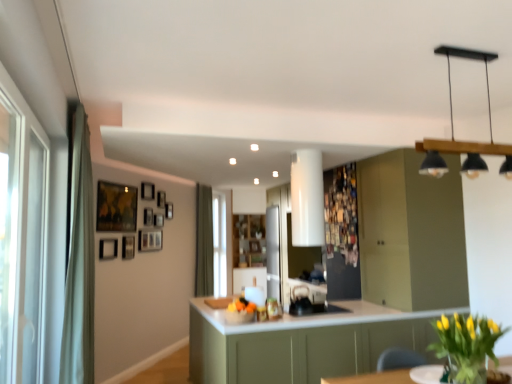
What do you see at coordinates (411, 233) in the screenshot?
I see `green matte cabinet at center, which is the 1th cabinetry from right to left` at bounding box center [411, 233].

This screenshot has height=384, width=512. Describe the element at coordinates (453, 131) in the screenshot. I see `black matte light fixture at upper right` at that location.

In order to click on wooden picture frame at upper left, the 4th picture frame viewed from the back in this screenshot , I will do point(148,216).

Locate an element on the screen. The image size is (512, 384). yellow-green leafy plant at lower right is located at coordinates (466, 345).

Image resolution: width=512 pixels, height=384 pixels. What are the coordinates of `wooden picture frame at center, positioned as the seventh picture frame in front-to-back order` in the screenshot? It's located at (158, 220).

Find the location of `wooden picture frame at upper center, the 2th picture frame when ordered from back to front`. wooden picture frame at upper center, the 2th picture frame when ordered from back to front is located at coordinates (161, 199).

Describe the element at coordinates (161, 199) in the screenshot. I see `wooden picture frame at upper center, the eighth picture frame viewed from the front` at that location.

I want to click on wooden framed map at upper left, the ninth picture frame in the back-to-front sequence, so click(x=116, y=207).

From a real-world perspective, count 1st picture frames upward from the white glossy round table at lower right and point to it. Please provide its 2D coordinates.

[(108, 249)]

Which is nearer, (111, 258) or (424, 376)?

The point (424, 376) is in front.

From the picture: Would you say matte black picture frame at upper left, placed as the 8th picture frame when sorted from back to front, is to the left or to the right of white glossy round table at lower right in the picture?

In the image, matte black picture frame at upper left, placed as the 8th picture frame when sorted from back to front, appears on the left side of white glossy round table at lower right.

Which object is closer to the camera, matte black picture frame at upper left, arranged as the second picture frame when viewed from the front, or white glossy round table at lower right?

white glossy round table at lower right.

Which is closer, (x=430, y=145) or (x=162, y=219)?

The point (x=430, y=145) is more forward.

Between black matte light fixture at upper right and wooden picture frame at center, marked as the third picture frame in a back-to-front arrangement, which one has smaller size?

With smaller size is wooden picture frame at center, marked as the third picture frame in a back-to-front arrangement.

From a real-world perspective, who is located higher, black matte light fixture at upper right or wooden picture frame at center, positioned as the seventh picture frame in front-to-back order?

From a 3D spatial view, black matte light fixture at upper right is above.

From the image's perspective, does black matte light fixture at upper right appear lower than wooden picture frame at center, positioned as the seventh picture frame in front-to-back order?

No, from the image's perspective, black matte light fixture at upper right is not below wooden picture frame at center, positioned as the seventh picture frame in front-to-back order.

Is black matte light fixture at upper right to the left of green matte cabinet at center, which ranks as the 1th cabinetry in left-to-right order, from the viewer's perspective?

No, black matte light fixture at upper right is not to the left of green matte cabinet at center, which ranks as the 1th cabinetry in left-to-right order.

Do you think black matte light fixture at upper right is within green matte cabinet at center, marked as the second cabinetry in a right-to-left arrangement, or outside of it?

The correct answer is: outside.

How different are the orientations of black matte light fixture at upper right and green matte cabinet at center, which ranks as the 1th cabinetry in left-to-right order, in degrees?

The angular difference between black matte light fixture at upper right and green matte cabinet at center, which ranks as the 1th cabinetry in left-to-right order, is 180 degrees.

Who is bigger, black matte light fixture at upper right or green matte cabinet at center, marked as the second cabinetry in a right-to-left arrangement?

green matte cabinet at center, marked as the second cabinetry in a right-to-left arrangement, is bigger.

Is wooden picture frame at upper left, which is counted as the 6th picture frame, starting from the front, far from green matte cabinet at center, which ranks as the 1th cabinetry in left-to-right order?

Yes, wooden picture frame at upper left, which is counted as the 6th picture frame, starting from the front, and green matte cabinet at center, which ranks as the 1th cabinetry in left-to-right order, are quite far apart.

Between wooden picture frame at upper left, which is counted as the 6th picture frame, starting from the front, and green matte cabinet at center, which ranks as the 1th cabinetry in left-to-right order, which one has smaller size?

wooden picture frame at upper left, which is counted as the 6th picture frame, starting from the front, is smaller.

This screenshot has width=512, height=384. Identify the location of picture frame that is the 6th object located behind the green matte cabinet at center, marked as the second cabinetry in a right-to-left arrangement. (148, 216).

Which of these two, wooden picture frame at upper left, which is counted as the 6th picture frame, starting from the front, or green matte cabinet at center, which ranks as the 1th cabinetry in left-to-right order, is thinner?

With smaller width is wooden picture frame at upper left, which is counted as the 6th picture frame, starting from the front.

Is matte black picture frame at upper left, placed as the 8th picture frame when sorted from back to front, positioned in front of wooden picture frame at center, positioned as the seventh picture frame in front-to-back order?

Yes, matte black picture frame at upper left, placed as the 8th picture frame when sorted from back to front, is closer to the camera.

Could you tell me if matte black picture frame at upper left, placed as the 8th picture frame when sorted from back to front, is turned towards wooden picture frame at center, positioned as the seventh picture frame in front-to-back order?

No, matte black picture frame at upper left, placed as the 8th picture frame when sorted from back to front, is not oriented towards wooden picture frame at center, positioned as the seventh picture frame in front-to-back order.

Measure the distance between matte black picture frame at upper left, arranged as the second picture frame when viewed from the front, and wooden picture frame at center, positioned as the seventh picture frame in front-to-back order.

The distance of matte black picture frame at upper left, arranged as the second picture frame when viewed from the front, from wooden picture frame at center, positioned as the seventh picture frame in front-to-back order, is 33.00 inches.

Which is less distant, (102, 246) or (154, 214)?

The point (102, 246) is closer.

Is green matte cabinet at center, which ranks as the 1th cabinetry in left-to-right order, shorter than green fabric curtain at left, arranged as the 1th curtain when viewed from the left?

Correct, green matte cabinet at center, which ranks as the 1th cabinetry in left-to-right order, is not as tall as green fabric curtain at left, arranged as the 1th curtain when viewed from the left.

Is green matte cabinet at center, marked as the second cabinetry in a right-to-left arrangement, bigger than green fabric curtain at left, which appears as the 1th curtain when viewed from the front?

Correct, green matte cabinet at center, marked as the second cabinetry in a right-to-left arrangement, is larger in size than green fabric curtain at left, which appears as the 1th curtain when viewed from the front.

Would you consider green matte cabinet at center, which ranks as the 1th cabinetry in left-to-right order, to be distant from green fabric curtain at left, arranged as the 1th curtain when viewed from the left?

Yes.

Considering the sizes of green matte cabinet at center, which ranks as the 1th cabinetry in left-to-right order, and green fabric curtain at left, which appears as the 1th curtain when viewed from the front, in the image, is green matte cabinet at center, which ranks as the 1th cabinetry in left-to-right order, wider or thinner than green fabric curtain at left, which appears as the 1th curtain when viewed from the front,?

Clearly, green matte cabinet at center, which ranks as the 1th cabinetry in left-to-right order, has more width compared to green fabric curtain at left, which appears as the 1th curtain when viewed from the front.

How many degrees apart are the facing directions of wooden picture frame at upper left, the 4th picture frame viewed from the back, and transparent glass door at left?

34.9 degrees separate the facing orientations of wooden picture frame at upper left, the 4th picture frame viewed from the back, and transparent glass door at left.

Which object is more forward, wooden picture frame at upper left, which is counted as the 6th picture frame, starting from the front, or transparent glass door at left?

transparent glass door at left is in front.

Between wooden picture frame at upper left, which is counted as the 6th picture frame, starting from the front, and transparent glass door at left, which one has less height?

wooden picture frame at upper left, which is counted as the 6th picture frame, starting from the front.

Does wooden picture frame at upper left, the 4th picture frame viewed from the back, touch transparent glass door at left?

No, wooden picture frame at upper left, the 4th picture frame viewed from the back, is not making contact with transparent glass door at left.

This screenshot has width=512, height=384. Identify the location of round table that is in front of the matte black picture frame at upper left, arranged as the second picture frame when viewed from the front. (426, 374).

From a real-world perspective, which picture frame is the 6th one underneath the black matte light fixture at upper right? Please provide its 2D coordinates.

[(158, 220)]

From the image, which object appears to be nearer to green fabric curtain at center, the 2th curtain viewed from the front, wooden picture frame at upper center, the fifth picture frame positioned from the back, or wooden picture frame at center, positioned as the seventh picture frame in front-to-back order?

Among the two, wooden picture frame at center, positioned as the seventh picture frame in front-to-back order, is located nearer to green fabric curtain at center, the 2th curtain viewed from the front.

Based on their spatial positions, is white glossy round table at lower right or yellow-green leafy plant at lower right closer to matte black picture frame at upper left, placed as the 8th picture frame when sorted from back to front?

Among the two, white glossy round table at lower right is located nearer to matte black picture frame at upper left, placed as the 8th picture frame when sorted from back to front.

Considering their positions, is wooden picture frame at upper center, the 2th picture frame when ordered from back to front, positioned closer to matte black picture frame at upper left, arranged as the second picture frame when viewed from the front, than wooden picture frame at upper left, which is counted as the 6th picture frame, starting from the front?

wooden picture frame at upper left, which is counted as the 6th picture frame, starting from the front, is closer to matte black picture frame at upper left, arranged as the second picture frame when viewed from the front.

From the image, which object appears to be nearer to green fabric curtain at center, positioned as the 1th curtain in right-to-left order, wooden picture frame at upper left, which is counted as the 6th picture frame, starting from the front, or transparent glass door at left?

wooden picture frame at upper left, which is counted as the 6th picture frame, starting from the front, lies closer to green fabric curtain at center, positioned as the 1th curtain in right-to-left order, than the other object.

Looking at the image, which one is located closer to green matte cabinet at center, which is the 1th cabinetry from right to left, wooden picture frame at center, marked as the third picture frame in a back-to-front arrangement, or wooden picture frame at upper center, the eighth picture frame viewed from the front?

wooden picture frame at upper center, the eighth picture frame viewed from the front.

When comparing their distances from wooden picture frame at upper center, the fifth picture frame positioned from the back, does green fabric curtain at center, the 2th curtain when ordered from left to right, or wooden framed map at upper left, the ninth picture frame in the back-to-front sequence, seem closer?

wooden framed map at upper left, the ninth picture frame in the back-to-front sequence, is positioned closer to the anchor wooden picture frame at upper center, the fifth picture frame positioned from the back.

Looking at the image, which one is located closer to green matte cabinet at center, positioned as the second cabinetry in left-to-right order, transparent glass door at left or wooden picture frame at upper left, the 9th picture frame from the front?

Based on the image, wooden picture frame at upper left, the 9th picture frame from the front, appears to be nearer to green matte cabinet at center, positioned as the second cabinetry in left-to-right order.

Considering their positions, is wooden picture frame at upper left, marked as the 1th picture frame in a back-to-front arrangement, positioned further to green matte cabinet at center, positioned as the second cabinetry in left-to-right order, than green fabric curtain at left, arranged as the 2th curtain when viewed from the right?

Based on the image, wooden picture frame at upper left, marked as the 1th picture frame in a back-to-front arrangement, appears to be further to green matte cabinet at center, positioned as the second cabinetry in left-to-right order.

Where is `light fixture between yellow-green leafy plant at lower right and green matte cabinet at center, positioned as the second cabinetry in left-to-right order, along the z-axis`? This screenshot has width=512, height=384. light fixture between yellow-green leafy plant at lower right and green matte cabinet at center, positioned as the second cabinetry in left-to-right order, along the z-axis is located at coordinates click(453, 131).

I want to click on round table located between yellow-green leafy plant at lower right and wooden picture frame at upper left, which is counted as the 6th picture frame, starting from the front, in the depth direction, so click(x=426, y=374).

This screenshot has width=512, height=384. Find the location of `curtain positioned between yellow-green leafy plant at lower right and wooden picture frame at upper center, positioned as the fourth picture frame in front-to-back order, from near to far`. curtain positioned between yellow-green leafy plant at lower right and wooden picture frame at upper center, positioned as the fourth picture frame in front-to-back order, from near to far is located at coordinates (79, 258).

This screenshot has width=512, height=384. I want to click on light fixture between yellow-green leafy plant at lower right and wooden picture frame at upper left, the 4th picture frame viewed from the back, along the z-axis, so click(453, 131).